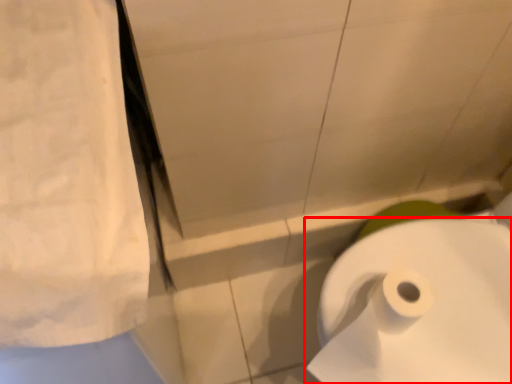
Question: Where is toilet paper (annotated by the red box) located in relation to linen in the image?

Choices:
 (A) right
 (B) left

Answer: (A)